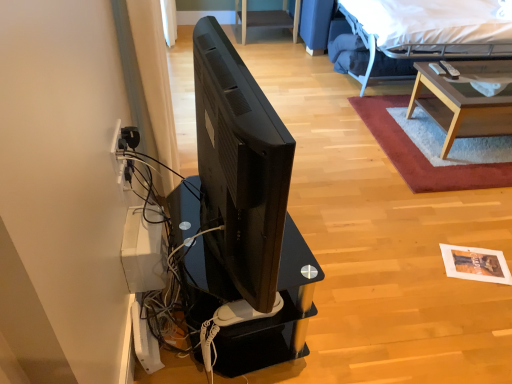
Question: From the image's perspective, is white fabric bed at upper right above or below black glossy desk at center?

Choices:
 (A) above
 (B) below

Answer: (A)

Question: Would you say white fabric bed at upper right is to the left or to the right of black glossy desk at center in the picture?

Choices:
 (A) left
 (B) right

Answer: (B)

Question: Considering the real-world distances, which object is farthest from the shaggy red rug at upper right?

Choices:
 (A) black glossy desk at center
 (B) light brown wooden table at upper right
 (C) black matte television at center
 (D) white fabric bed at upper right
 (E) white plastic electric outlet at left

Answer: (E)

Question: Which object is the closest to the black matte television at center?

Choices:
 (A) black glossy desk at center
 (B) white plastic electric outlet at left
 (C) white fabric bed at upper right
 (D) shaggy red rug at upper right
 (E) light brown wooden table at upper right

Answer: (A)